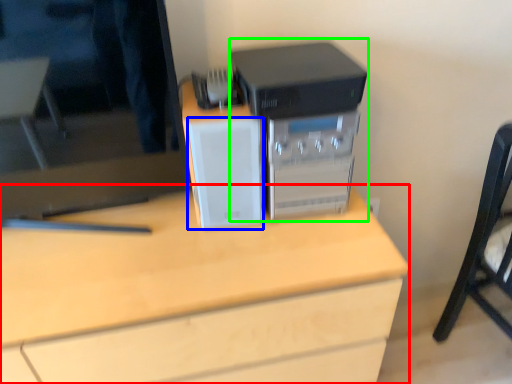
Question: Estimate the real-world distances between objects in this image. Which object is farther from desk (highlighted by a red box), speaker (highlighted by a blue box) or home appliance (highlighted by a green box)?

Choices:
 (A) speaker
 (B) home appliance

Answer: (B)